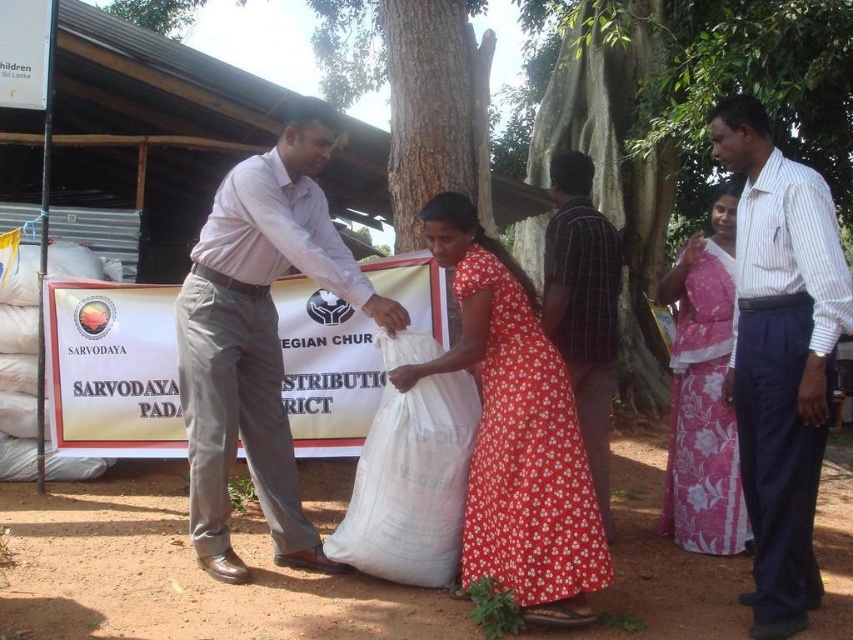
Which of these two, light gray trousers at center or pink floral fabric dress at right, stands shorter?

With less height is pink floral fabric dress at right.

Between point (273, 364) and point (682, 301), which one is positioned behind?

The point (682, 301) is behind.

The height and width of the screenshot is (640, 853). I want to click on light gray trousers at center, so click(258, 337).

Who is more forward, (256, 458) or (593, 422)?

Point (256, 458)

Which is in front, point (202, 404) or point (608, 312)?

Point (202, 404) is more forward.

This screenshot has height=640, width=853. What are the coordinates of `light gray trousers at center` in the screenshot? It's located at (258, 337).

Which is behind, point (540, 464) or point (680, 477)?

The point (680, 477) is more distant.

From the picture: Measure the distance between floral cotton dress at center and camera.

A distance of 8.44 feet exists between floral cotton dress at center and camera.

Find the location of a particular element. Image resolution: width=853 pixels, height=640 pixels. floral cotton dress at center is located at coordinates (525, 456).